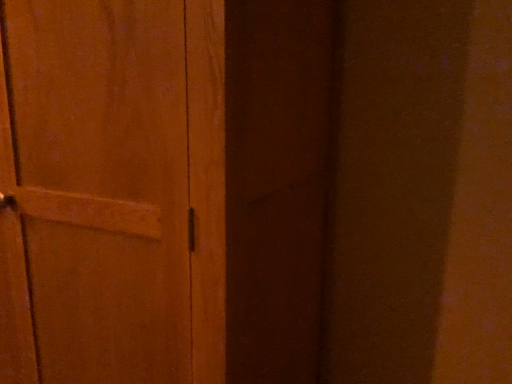
The height and width of the screenshot is (384, 512). What do you see at coordinates (118, 185) in the screenshot?
I see `matte wood door at center` at bounding box center [118, 185].

Find the location of a particular element. Image resolution: width=512 pixels, height=384 pixels. matte wood door at center is located at coordinates (118, 185).

Locate an element on the screen. The height and width of the screenshot is (384, 512). matte wood door at center is located at coordinates (118, 185).